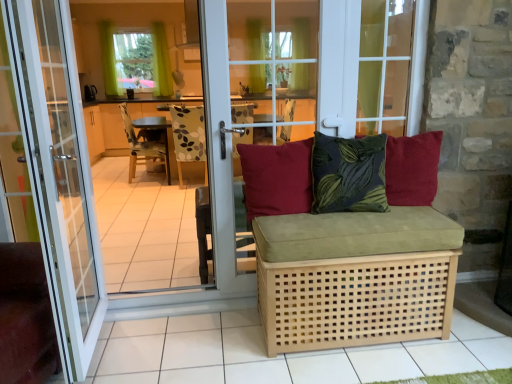
This screenshot has height=384, width=512. Find the location of `free point to the left of light brown woven studio couch at center`. free point to the left of light brown woven studio couch at center is located at coordinates (210, 345).